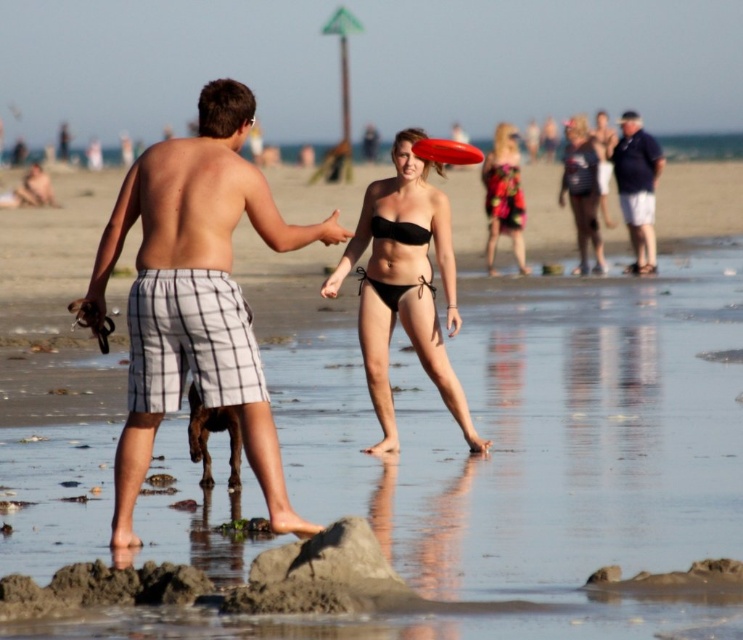
Question: Which of the following is the farthest from the observer?

Choices:
 (A) dark blue shirt at upper right
 (B) floral dress at center
 (C) red plastic frisbee at center

Answer: (B)

Question: Which point is closer to the camera?

Choices:
 (A) dark blue shirt at upper right
 (B) black matte bikini at center
 (C) matte black bikini at center
 (D) black matte bikini top at center

Answer: (D)

Question: Can you confirm if black matte bikini at center is thinner than red plastic frisbee at center?

Choices:
 (A) no
 (B) yes

Answer: (B)

Question: Is floral dress at center to the right of black matte bikini top at center from the viewer's perspective?

Choices:
 (A) no
 (B) yes

Answer: (B)

Question: Which point is farther to the camera?

Choices:
 (A) (499, 179)
 (B) (584, 272)
 (C) (648, 198)
 (D) (123, 470)

Answer: (C)

Question: Is black bikini at center positioned at the back of black matte bikini at center?

Choices:
 (A) yes
 (B) no

Answer: (B)